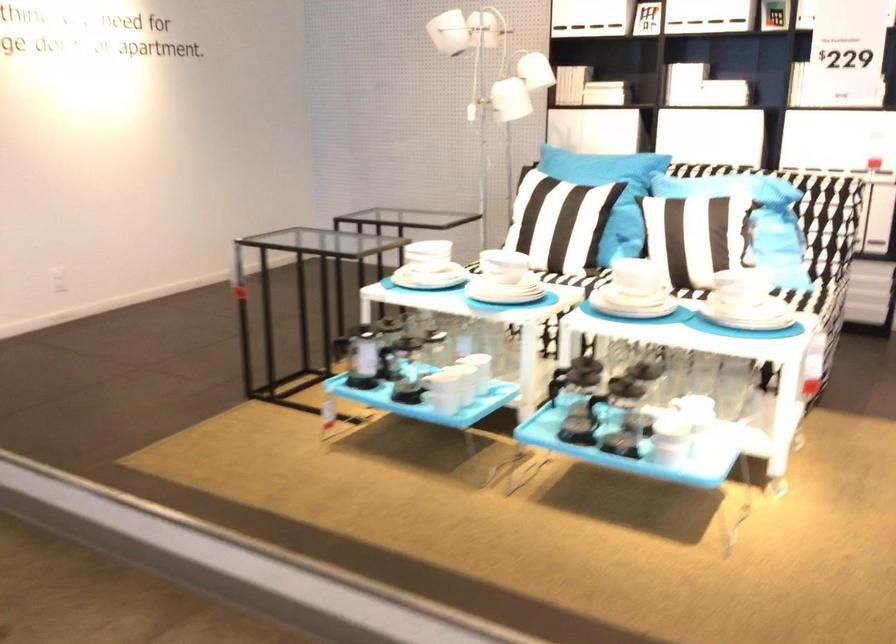
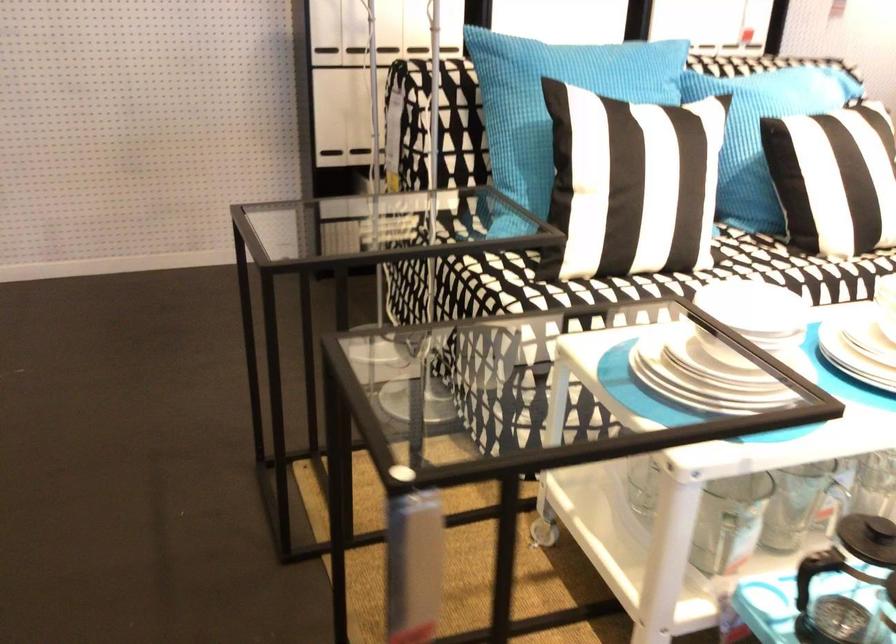
The point at (667,223) is marked in the first image. Where is the corresponding point in the second image?

(833, 178)